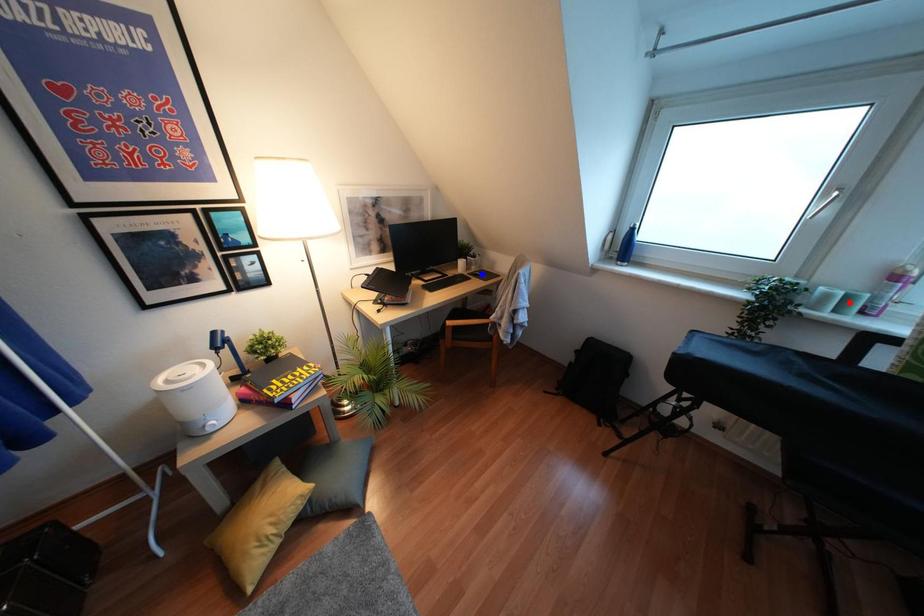
Question: Two points are marked on the image. Which point is closer to the camera?

Choices:
 (A) Blue point is closer.
 (B) Red point is closer.

Answer: (B)